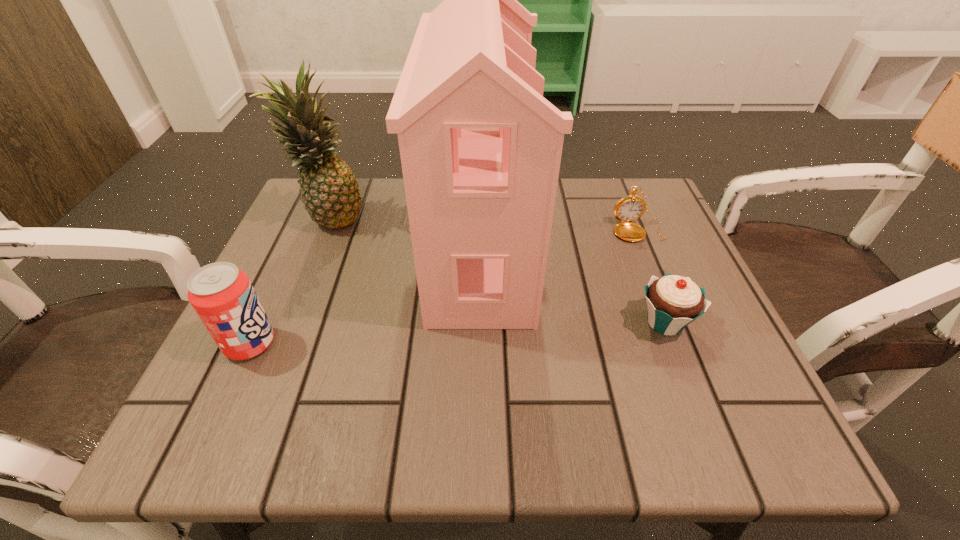
The height and width of the screenshot is (540, 960). I want to click on the tallest object, so click(x=480, y=147).

You are a GUI agent. You are given a task and a screenshot of the screen. Output one action in this format:
    pyautogui.click(x=<x>, y=<y>)
    Task: Click on the third object from right to left
    
    Given the screenshot: What is the action you would take?
    pyautogui.click(x=480, y=147)

The width and height of the screenshot is (960, 540). In order to click on pineapple in this screenshot , I will do `click(329, 189)`.

Where is `soda can`? soda can is located at coordinates (222, 295).

The image size is (960, 540). In order to click on cupcake in this screenshot , I will do `click(673, 302)`.

You are a GUI agent. You are given a task and a screenshot of the screen. Output one action in this format:
    pyautogui.click(x=<x>, y=<y>)
    Task: Click on the pocket watch
    This screenshot has width=960, height=540.
    Given the screenshot: What is the action you would take?
    pyautogui.click(x=630, y=208)

At what (x,y) coordinates should I click in order to perform the action: click on vacant space situated 0.270m on the front-facing side of the tallest object. Please return your answer as a coordinate pair (x, y). Looking at the image, I should click on (659, 245).

You are a GUI agent. You are given a task and a screenshot of the screen. Output one action in this format:
    pyautogui.click(x=<x>, y=<y>)
    Task: Click on the vacant space situated 0.050m on the right of the pineapple
    The height and width of the screenshot is (540, 960).
    Given the screenshot: What is the action you would take?
    (387, 220)

The width and height of the screenshot is (960, 540). What are the coordinates of `free space located on the surface of the soda can` in the screenshot? It's located at (428, 343).

Locate an element on the screen. The image size is (960, 540). free point located 0.140m on the left of the cupcake is located at coordinates (557, 322).